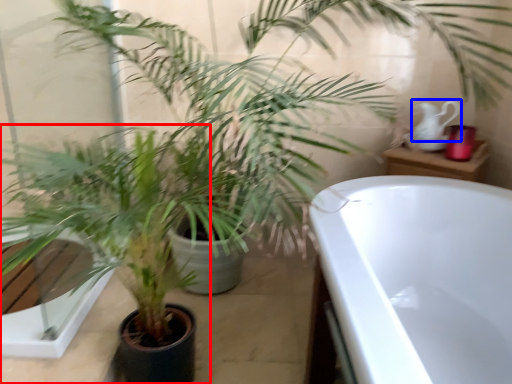
Question: Which point is closer to the camera, houseplant (highlighted by a red box) or tea pot (highlighted by a blue box)?

Choices:
 (A) houseplant
 (B) tea pot

Answer: (A)